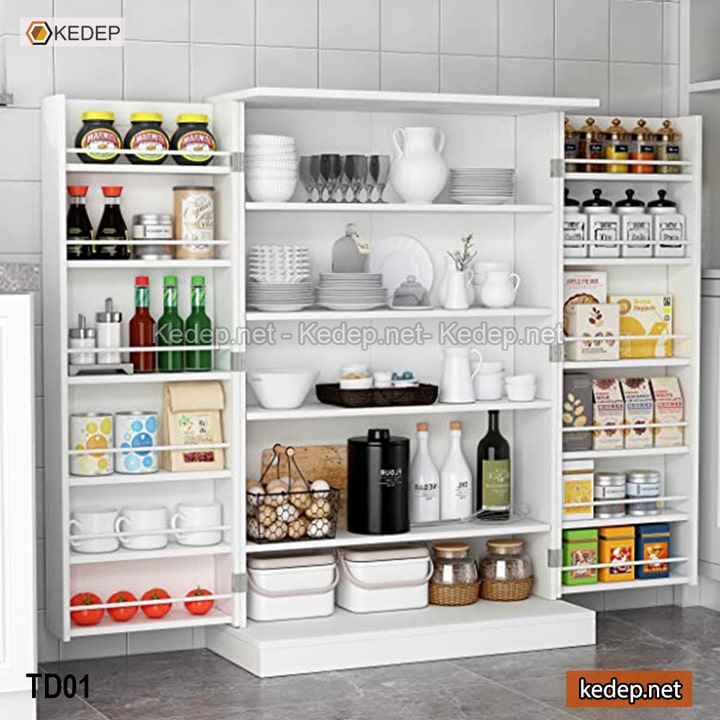
At what (x,y) coordinates should I click in order to perform the action: click on boxes. Please return your answer as a coordinate pair (x, y). Image resolution: width=720 pixels, height=720 pixels. Looking at the image, I should click on (607, 405), (636, 418), (670, 410), (572, 408), (606, 324), (580, 284), (649, 307).